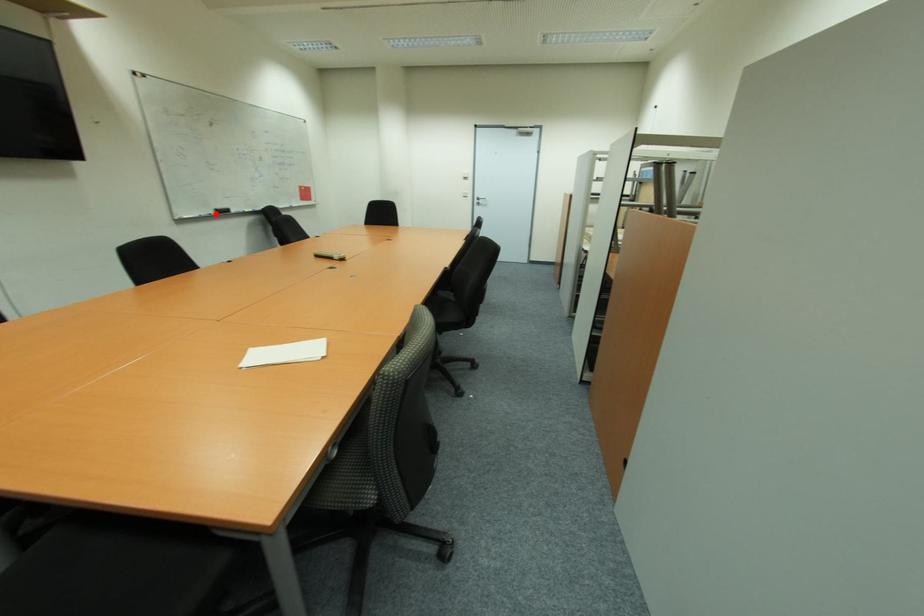
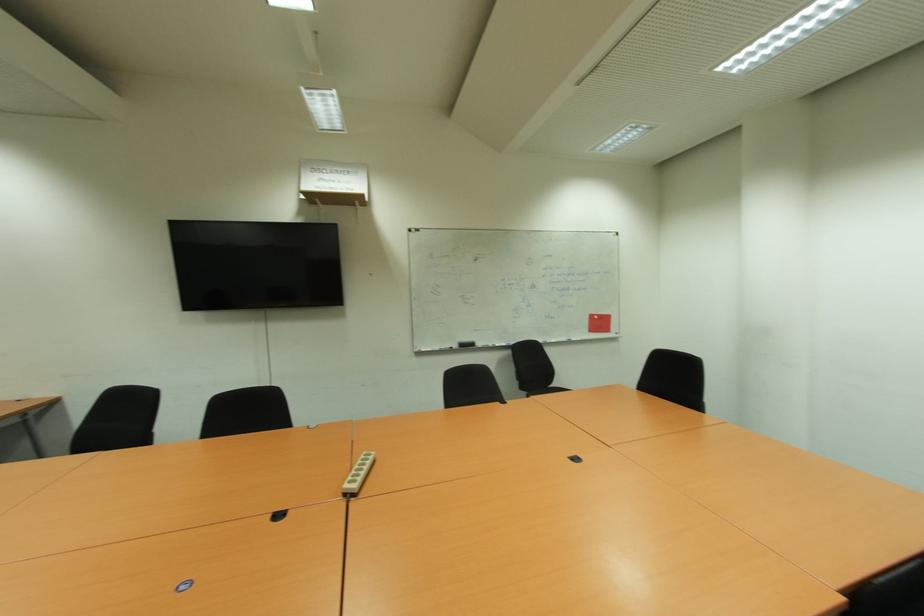
Find the pixel in the second image that matches the highlighted location in the first image.

(457, 347)